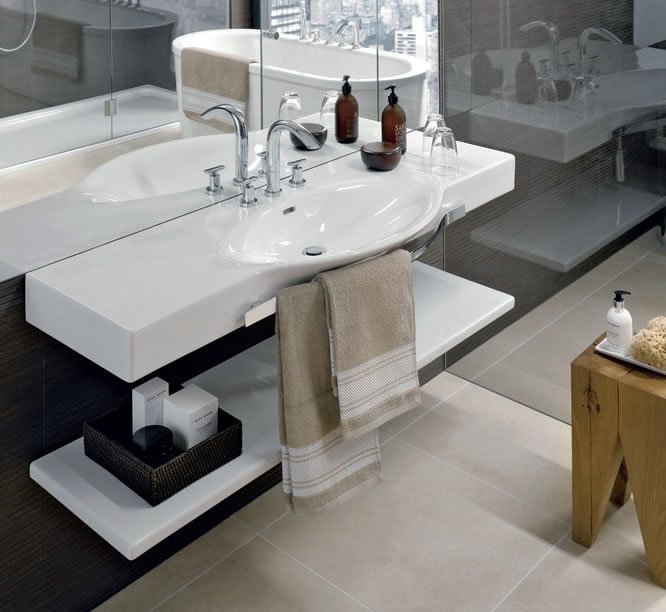
I want to click on beige floor, so click(x=437, y=554).